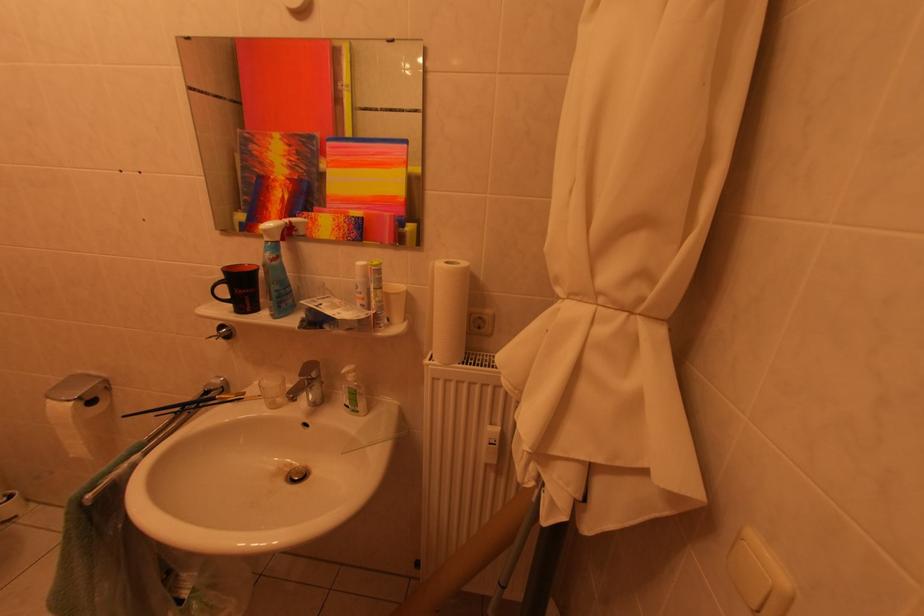
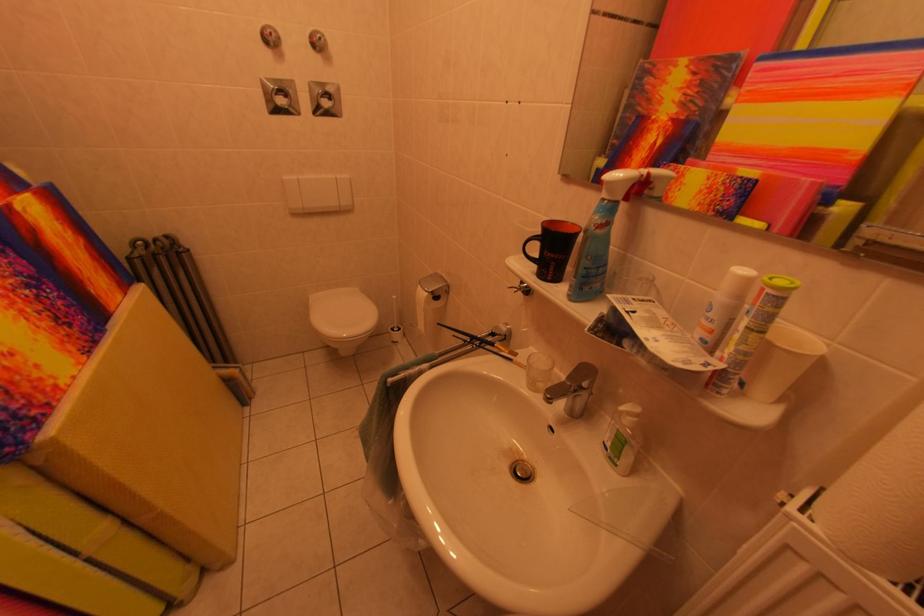
Where in the second image is the point corresponding to the point at 238,310 from the first image?

(543, 270)